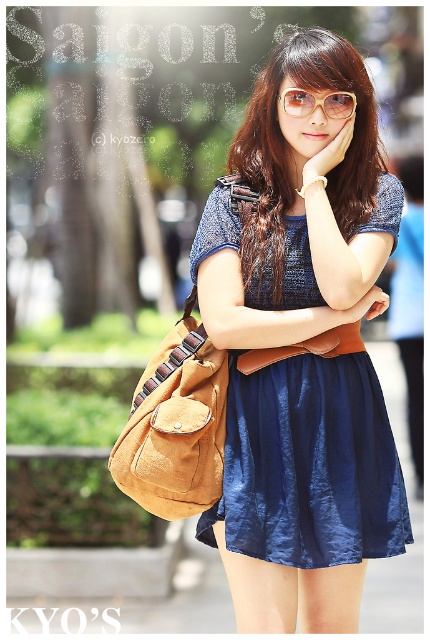
You are a fashion designer observing a model wearing the matte blue dress at center and carrying the suede brown shoulder bag at center. You need to design a new accessory that can be worn between them. What is the minimum length of the accessory to ensure it can comfortably reach from the dress to the bag?

The minimum length of the accessory should be at least 33.28 inches to comfortably reach from the matte blue dress at center to the suede brown shoulder bag at center.

You are a fashion designer observing a model wearing a satin blue skirt at center and carrying a suede brown shoulder bag at center. You need to adjust the placement of the bag so that it is closer to the skirt. What is the minimum distance you can move the bag to ensure it is at least 12 inches away from the skirt?

The current distance between the satin blue skirt at center and the suede brown shoulder bag at center is 14.53 inches. To ensure the bag is at least 12 inches away from the skirt, you can move it closer by up to 2.53 inches.